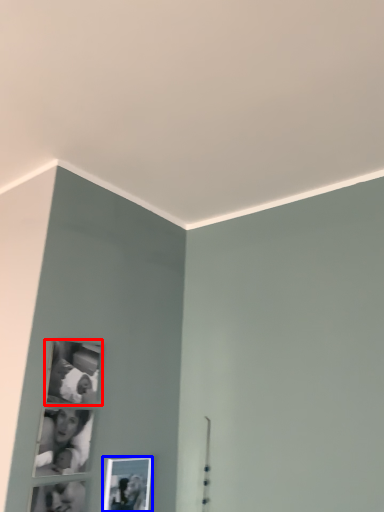
Question: Among these objects, which one is nearest to the camera, picture frame (highlighted by a red box) or picture frame (highlighted by a blue box)?

Choices:
 (A) picture frame
 (B) picture frame

Answer: (A)